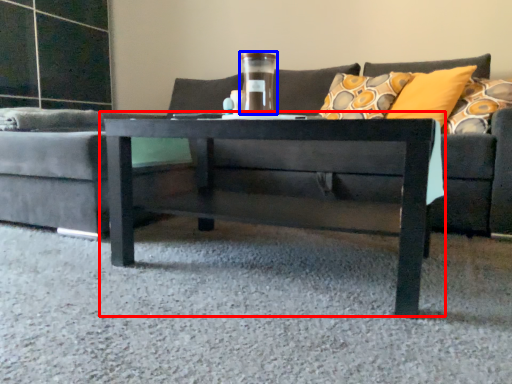
Question: Which point is further to the camera, coffee table (highlighted by a red box) or glass vase (highlighted by a blue box)?

Choices:
 (A) coffee table
 (B) glass vase

Answer: (B)